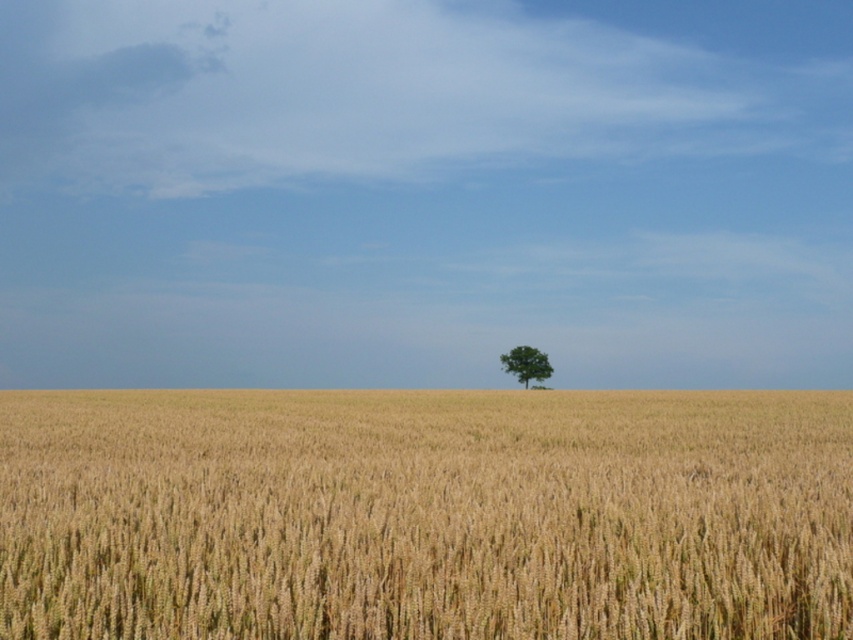
You are standing in the wheat field and want to reach the point marked as point (553, 464). If your walking speed is 1.5 meters per second, how many seconds will it take you to reach the point?

The distance between you and point (553, 464) is 10.57 meters. At a walking speed of 1.5 meters per second, it will take approximately 7.05 seconds to reach the point.

You are a farmer checking the growth of your crops. You notice the golden wheat field at center and the green matte tree at center. Which one has a greater height?

The green matte tree at center is taller than the golden wheat field at center.

You are a farmer planning to plant a new row of wheat. You have a tractor that can cover a 30 meter straight path. If you start at the golden wheat field at center, can you reach the green matte tree at center without stopping?

The golden wheat field at center and green matte tree at center are 28.92 meters apart from each other. Since the tractor can cover 30 meters, it can reach the green matte tree at center without stopping.